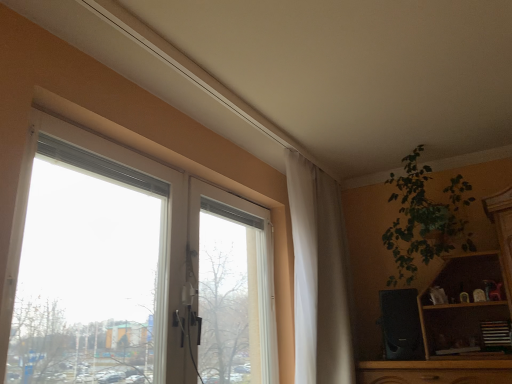
Question: Is white sheer curtain at center closer to camera compared to transparent glass window at upper left?

Choices:
 (A) yes
 (B) no

Answer: (B)

Question: Is white sheer curtain at center positioned far away from transparent glass window at upper left?

Choices:
 (A) no
 (B) yes

Answer: (A)

Question: Does white sheer curtain at center have a smaller size compared to transparent glass window at upper left?

Choices:
 (A) no
 (B) yes

Answer: (A)

Question: Is white sheer curtain at center at the left side of transparent glass window at upper left?

Choices:
 (A) yes
 (B) no

Answer: (B)

Question: Is white sheer curtain at center taller than transparent glass window at upper left?

Choices:
 (A) no
 (B) yes

Answer: (B)

Question: In the image, is white sheer curtain at center positioned in front of or behind transparent glass window at upper left?

Choices:
 (A) behind
 (B) front

Answer: (A)

Question: Would you say white sheer curtain at center is to the left or to the right of transparent glass window at upper left in the picture?

Choices:
 (A) right
 (B) left

Answer: (A)

Question: Is white sheer curtain at center spatially inside transparent glass window at upper left, or outside of it?

Choices:
 (A) outside
 (B) inside

Answer: (A)

Question: From a real-world perspective, is white sheer curtain at center positioned above or below transparent glass window at upper left?

Choices:
 (A) above
 (B) below

Answer: (A)

Question: From a real-world perspective, relative to green leafy plant at upper right, is white sheer curtain at center vertically above or below?

Choices:
 (A) above
 (B) below

Answer: (B)

Question: Based on their sizes in the image, would you say white sheer curtain at center is bigger or smaller than green leafy plant at upper right?

Choices:
 (A) small
 (B) big

Answer: (B)

Question: Is white sheer curtain at center inside the boundaries of green leafy plant at upper right, or outside?

Choices:
 (A) inside
 (B) outside

Answer: (B)

Question: Is white sheer curtain at center taller or shorter than green leafy plant at upper right?

Choices:
 (A) short
 (B) tall

Answer: (B)

Question: Relative to white sheer curtain at center, is green leafy plant at upper right in front or behind?

Choices:
 (A) behind
 (B) front

Answer: (A)

Question: Do you think green leafy plant at upper right is within white sheer curtain at center, or outside of it?

Choices:
 (A) outside
 (B) inside

Answer: (A)